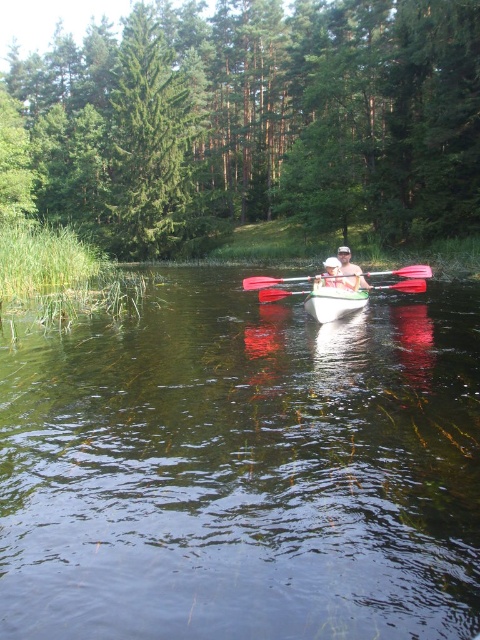
Who is higher up, green plastic kayak at center or matte black paddle at center?

Positioned higher is matte black paddle at center.

Does green plastic kayak at center have a greater height compared to matte black paddle at center?

No, green plastic kayak at center is not taller than matte black paddle at center.

Between point (389, 500) and point (286, 280), which one is positioned behind?

Positioned behind is point (286, 280).

Identify the location of green plastic kayak at center. The image size is (480, 640). (243, 468).

Which is below, green leafy tree at center or red plastic paddle at center?

red plastic paddle at center is below.

Is point (257, 49) positioned before point (269, 298)?

No, it is behind (269, 298).

Find the location of `green leafy tree at center`. green leafy tree at center is located at coordinates (272, 116).

Which is below, white plastic canoe at center or matte white kayak at center?

Positioned lower is white plastic canoe at center.

Is white plastic canoe at center above matte white kayak at center?

No, white plastic canoe at center is not above matte white kayak at center.

Which is in front, point (334, 298) or point (336, 284)?

Point (334, 298) is more forward.

Locate an element on the screen. The height and width of the screenshot is (640, 480). white plastic canoe at center is located at coordinates (334, 301).